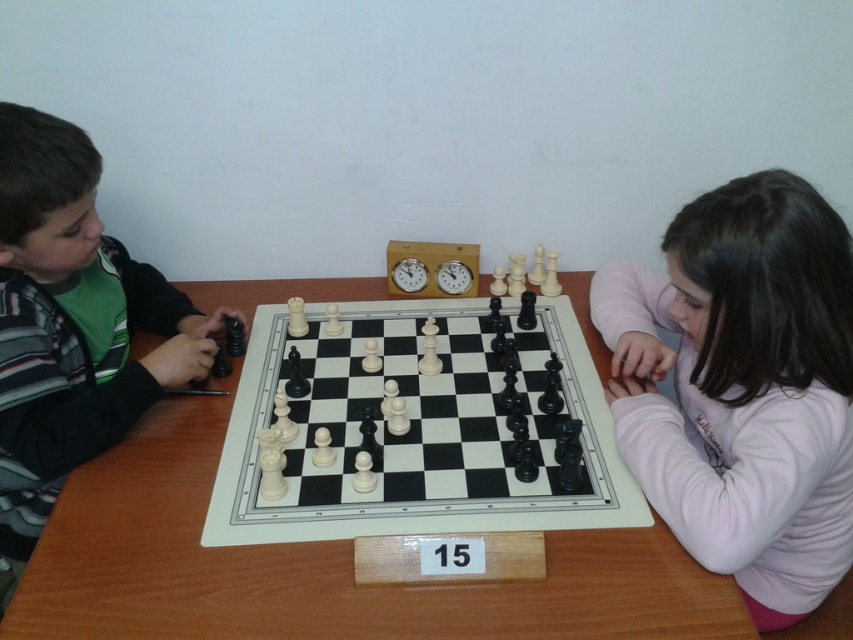
You are a photographer trying to capture a closeup of the chess pieces. You notice two points on the chessboard at coordinates point (x=569, y=561) and point (x=555, y=506). Which point should you focus on to ensure the chess piece at that location is in sharp focus?

Point (x=569, y=561) is closer to the camera than point (x=555, y=506), so focusing on point (x=569, y=561) will ensure the chess piece there is in sharp focus.

You are a photographer standing at the origin point of the coordinate system. The white wooden table at center is located at point (317,566). If you want to take a photo of the chessboard, which is placed on the white wooden table at center, where should you position yourself to capture the entire chessboard in the frame?

The white wooden table at center is located at point (317,566). To capture the entire chessboard in the frame, the photographer should position themselves directly above the table at the origin point, ensuring the camera is centered over the table to include all edges of the chessboard within the frame.